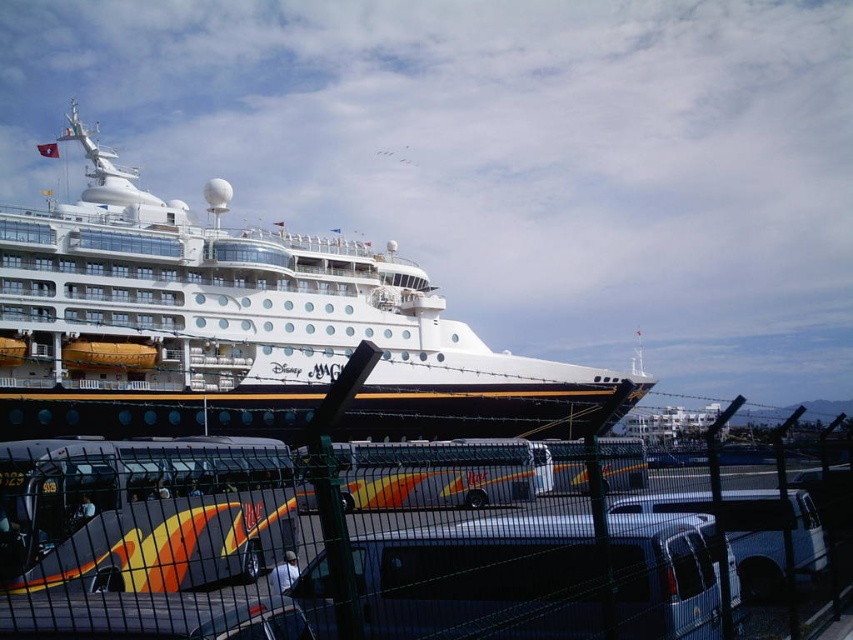
Question: Which of the following is the closest to the observer?

Choices:
 (A) (612, 564)
 (B) (288, 336)

Answer: (A)

Question: Which point is farther to the camera?

Choices:
 (A) white glossy cruise ship at center
 (B) black wire mesh fence at center

Answer: (A)

Question: Which point is farther to the camera?

Choices:
 (A) (207, 260)
 (B) (718, 604)

Answer: (A)

Question: Is black wire mesh fence at center to the left of white glossy cruise ship at center from the viewer's perspective?

Choices:
 (A) no
 (B) yes

Answer: (A)

Question: Does black wire mesh fence at center appear on the right side of white glossy cruise ship at center?

Choices:
 (A) yes
 (B) no

Answer: (A)

Question: Is black wire mesh fence at center to the left of white glossy cruise ship at center from the viewer's perspective?

Choices:
 (A) no
 (B) yes

Answer: (A)